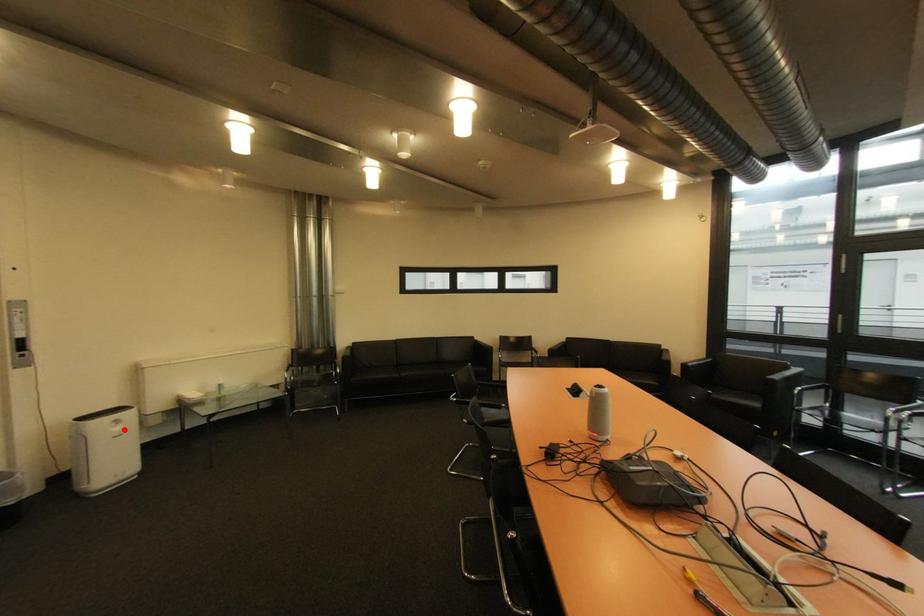
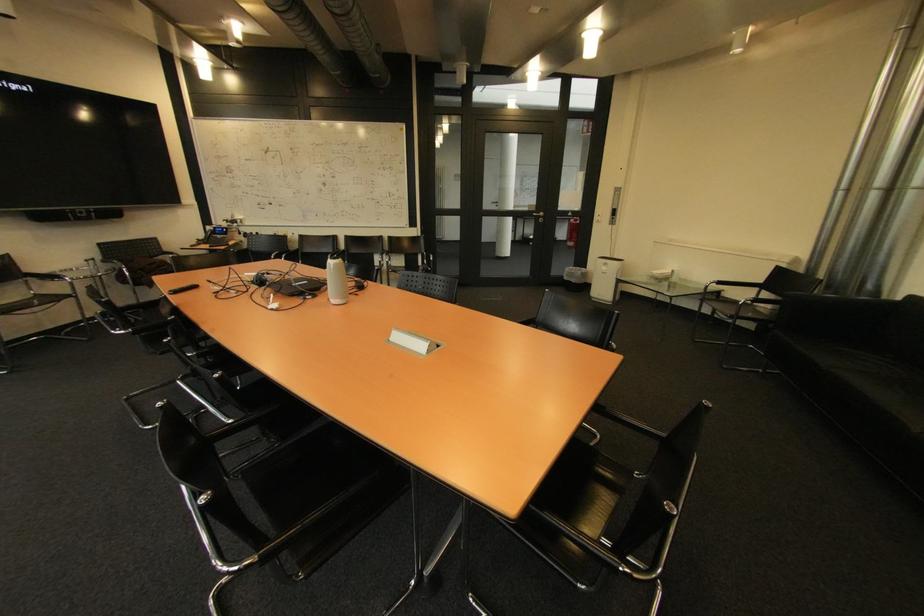
Question: I am providing you with two images of the same scene from different viewpoints. A red point is marked on the first image. Is the red point's position out of view in image 2?

Choices:
 (A) Yes
 (B) No

Answer: (B)